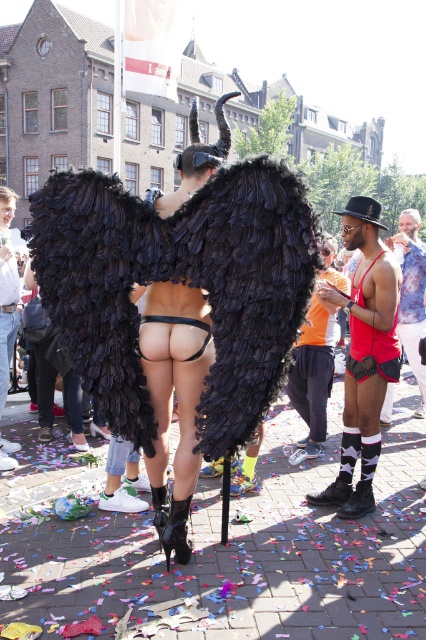
Question: Is shiny red fabric shorts at center behind black feathered wings at center?

Choices:
 (A) no
 (B) yes

Answer: (A)

Question: Estimate the real-world distances between objects in this image. Which object is closer to the shiny red fabric at right?

Choices:
 (A) reddish-orange tank top at center
 (B) shiny red fabric shorts at center

Answer: (B)

Question: Can you confirm if shiny red fabric shorts at center is bigger than black feathered wings at center?

Choices:
 (A) yes
 (B) no

Answer: (A)

Question: Which of these objects is positioned farthest from the reddish-orange tank top at center?

Choices:
 (A) shiny red fabric shorts at center
 (B) black feathered wings at center
 (C) shiny red fabric at right

Answer: (B)

Question: Which point appears farthest from the camera in this image?

Choices:
 (A) (13, 323)
 (B) (351, 198)
 (C) (412, 225)

Answer: (C)

Question: Is shiny red fabric shorts at center wider than shiny red fabric at right?

Choices:
 (A) yes
 (B) no

Answer: (B)